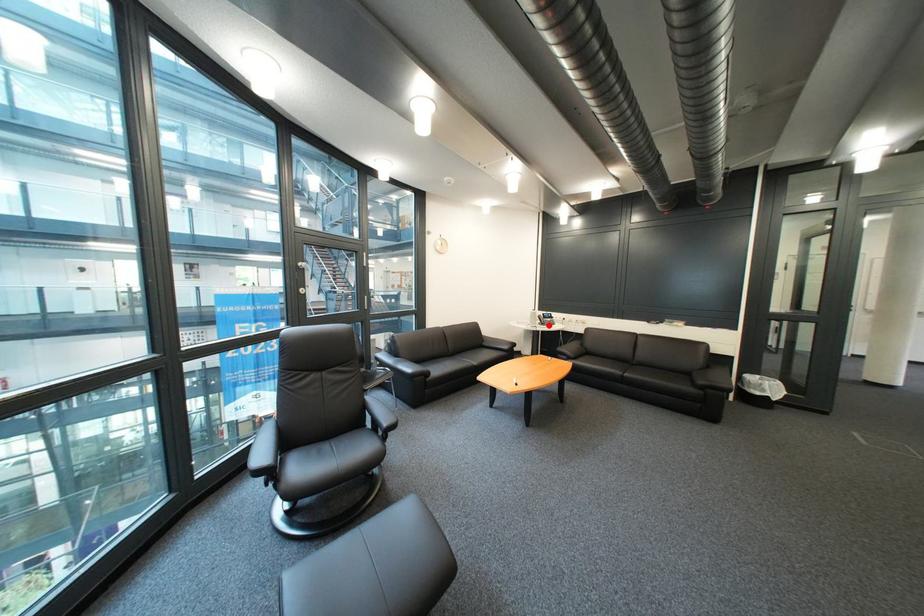
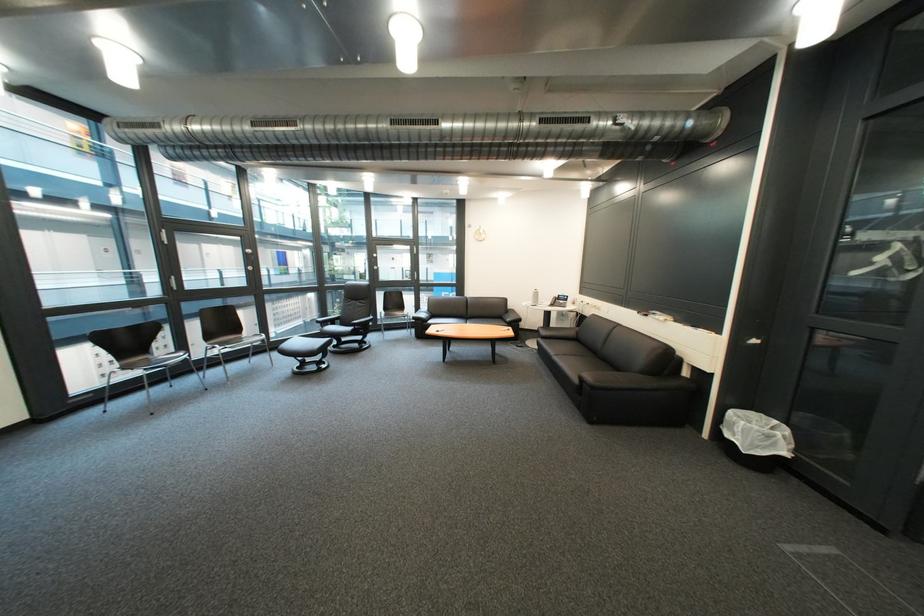
Where in the second image is the point corresponding to the highlighted location from the first image?

(552, 305)